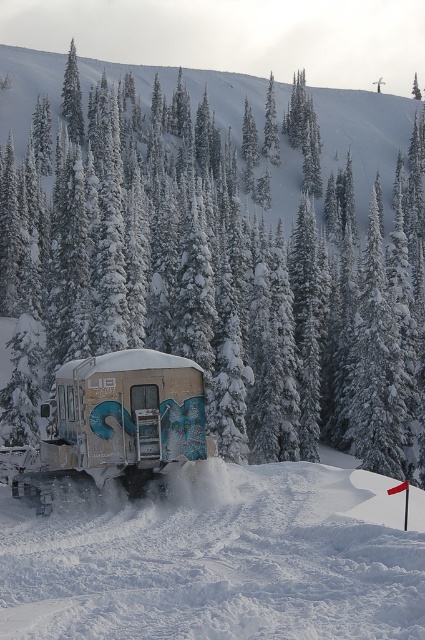
Question: Is the position of white snow-covered tree at center more distant than that of rusty metallic trailer at center?

Choices:
 (A) yes
 (B) no

Answer: (A)

Question: Is white powdery snow at center above rusty metallic trailer at center?

Choices:
 (A) yes
 (B) no

Answer: (B)

Question: Which object is the closest to the rusty metallic trailer at center?

Choices:
 (A) white snow-covered tree at center
 (B) white powdery snow at center

Answer: (B)

Question: Does white powdery snow at center come behind rusty metallic trailer at center?

Choices:
 (A) no
 (B) yes

Answer: (A)

Question: Among these points, which one is farthest from the camera?

Choices:
 (A) (104, 176)
 (B) (328, 541)

Answer: (A)

Question: Considering the real-world distances, which object is farthest from the white snow-covered tree at center?

Choices:
 (A) rusty metallic trailer at center
 (B) white powdery snow at center

Answer: (A)